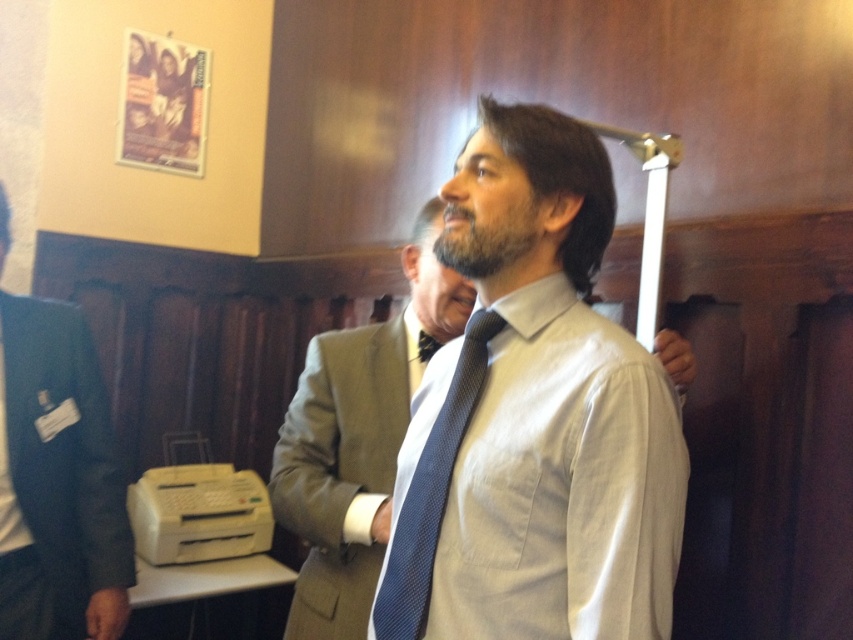
Question: Which object is farther from the camera taking this photo?

Choices:
 (A) white smooth dress shirt at center
 (B) light brown textured suit at center

Answer: (B)

Question: Is light brown textured suit at center bigger than blue textured tie at center?

Choices:
 (A) no
 (B) yes

Answer: (B)

Question: Can you confirm if dark blue suit at left is positioned below light brown textured suit at center?

Choices:
 (A) yes
 (B) no

Answer: (B)

Question: Observing the image, what is the correct spatial positioning of white smooth dress shirt at center in reference to light brown textured suit at center?

Choices:
 (A) below
 (B) above

Answer: (B)

Question: Based on their relative distances, which object is farther from the white smooth dress shirt at center?

Choices:
 (A) dark blue suit at left
 (B) light brown textured suit at center
 (C) blue textured tie at center

Answer: (A)

Question: Among these objects, which one is farthest from the camera?

Choices:
 (A) white smooth dress shirt at center
 (B) dark blue suit at left

Answer: (B)